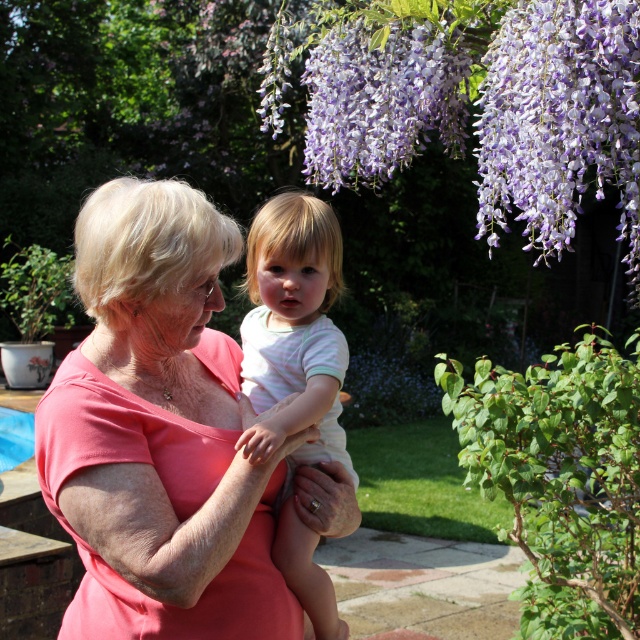
How far apart are white striped shirt at center and purple matte flowers at upper center?

A distance of 1.58 meters exists between white striped shirt at center and purple matte flowers at upper center.

You are a GUI agent. You are given a task and a screenshot of the screen. Output one action in this format:
    pyautogui.click(x=<x>, y=<y>)
    Task: Click on the white striped shirt at center
    
    Given the screenshot: What is the action you would take?
    click(x=292, y=326)

Does point (326, 227) lie behind point (317, 112)?

No, (326, 227) is in front of (317, 112).

This screenshot has height=640, width=640. What are the coordinates of `white striped shirt at center` in the screenshot? It's located at (292, 326).

Between pink matte shirt at center and purple matte flowers at upper center, which one appears on the right side from the viewer's perspective?

purple matte flowers at upper center

The width and height of the screenshot is (640, 640). Describe the element at coordinates (160, 433) in the screenshot. I see `pink matte shirt at center` at that location.

Which is behind, point (156, 353) or point (328, 51)?

The point (328, 51) is behind.

This screenshot has height=640, width=640. What are the coordinates of `pink matte shirt at center` in the screenshot? It's located at (160, 433).

From the picture: Which is below, pink matte shirt at center or white striped shirt at center?

pink matte shirt at center is lower down.

Where is `pink matte shirt at center`? Image resolution: width=640 pixels, height=640 pixels. pink matte shirt at center is located at coordinates (160, 433).

Which is in front, point (84, 305) or point (330, 454)?

Point (84, 305) is more forward.

Identify the location of pink matte shirt at center. Image resolution: width=640 pixels, height=640 pixels. (160, 433).